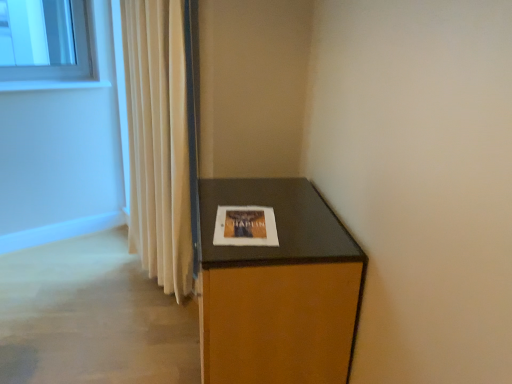
Question: Does white glossy window sill at upper left come in front of beige fabric curtain at left?

Choices:
 (A) yes
 (B) no

Answer: (B)

Question: Is there a large distance between white glossy window sill at upper left and beige fabric curtain at left?

Choices:
 (A) yes
 (B) no

Answer: (A)

Question: From a real-world perspective, does white glossy window sill at upper left stand above beige fabric curtain at left?

Choices:
 (A) no
 (B) yes

Answer: (B)

Question: Is white glossy window sill at upper left facing towards beige fabric curtain at left?

Choices:
 (A) no
 (B) yes

Answer: (A)

Question: From the image's perspective, is white glossy window sill at upper left on beige fabric curtain at left?

Choices:
 (A) yes
 (B) no

Answer: (A)

Question: In terms of width, does matte white picture frame at center look wider or thinner when compared to white glossy window sill at upper left?

Choices:
 (A) wide
 (B) thin

Answer: (A)

Question: Considering the positions of matte white picture frame at center and white glossy window sill at upper left in the image, is matte white picture frame at center taller or shorter than white glossy window sill at upper left?

Choices:
 (A) short
 (B) tall

Answer: (A)

Question: From the image's perspective, is matte white picture frame at center located above or below white glossy window sill at upper left?

Choices:
 (A) below
 (B) above

Answer: (A)

Question: In the image, is matte white picture frame at center positioned in front of or behind white glossy window sill at upper left?

Choices:
 (A) front
 (B) behind

Answer: (A)

Question: From the image's perspective, relative to brown wood cabinet at lower right, is white glossy window sill at upper left above or below?

Choices:
 (A) below
 (B) above

Answer: (B)

Question: Considering their positions, is white glossy window sill at upper left located in front of or behind brown wood cabinet at lower right?

Choices:
 (A) behind
 (B) front

Answer: (A)

Question: Is white glossy window sill at upper left inside the boundaries of brown wood cabinet at lower right, or outside?

Choices:
 (A) inside
 (B) outside

Answer: (B)

Question: Is point (24, 89) positioned closer to the camera than point (287, 213)?

Choices:
 (A) farther
 (B) closer

Answer: (A)

Question: From a real-world perspective, is matte white picture frame at center positioned above or below beige fabric curtain at left?

Choices:
 (A) below
 (B) above

Answer: (B)

Question: Based on their sizes in the image, would you say matte white picture frame at center is bigger or smaller than beige fabric curtain at left?

Choices:
 (A) small
 (B) big

Answer: (A)